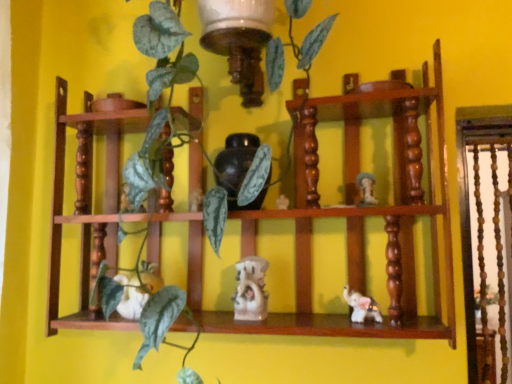
Question: From the image's perspective, is white glossy elephant at lower right, positioned as the third toy in left-to-right order, under wooden shelf at center?

Choices:
 (A) yes
 (B) no

Answer: (A)

Question: Can we say white glossy elephant at lower right, positioned as the second toy in right-to-left order, lies outside wooden shelf at center?

Choices:
 (A) yes
 (B) no

Answer: (B)

Question: Is the position of white glossy elephant at lower right, positioned as the second toy in right-to-left order, more distant than that of wooden shelf at center?

Choices:
 (A) yes
 (B) no

Answer: (A)

Question: Is white glossy elephant at lower right, positioned as the second toy in right-to-left order, positioned before wooden shelf at center?

Choices:
 (A) no
 (B) yes

Answer: (A)

Question: From a real-world perspective, is white glossy elephant at lower right, positioned as the second toy in right-to-left order, over wooden shelf at center?

Choices:
 (A) no
 (B) yes

Answer: (A)

Question: From the image's perspective, is matte black vase at center located above or below white matte rabbit at center, arranged as the first toy when viewed from the left?

Choices:
 (A) above
 (B) below

Answer: (A)

Question: Is matte black vase at center wider or thinner than white matte rabbit at center, the fourth toy from the right?

Choices:
 (A) thin
 (B) wide

Answer: (B)

Question: Which is correct: matte black vase at center is inside white matte rabbit at center, arranged as the first toy when viewed from the left, or outside of it?

Choices:
 (A) inside
 (B) outside

Answer: (B)

Question: Considering the positions of matte black vase at center and white matte rabbit at center, arranged as the first toy when viewed from the left, in the image, is matte black vase at center taller or shorter than white matte rabbit at center, arranged as the first toy when viewed from the left,?

Choices:
 (A) tall
 (B) short

Answer: (A)

Question: Considering the positions of wooden shelf at center and matte black vase at center in the image, is wooden shelf at center taller or shorter than matte black vase at center?

Choices:
 (A) tall
 (B) short

Answer: (A)

Question: In the image, is wooden shelf at center positioned in front of or behind matte black vase at center?

Choices:
 (A) front
 (B) behind

Answer: (A)

Question: Considering the positions of wooden shelf at center and matte black vase at center in the image, is wooden shelf at center bigger or smaller than matte black vase at center?

Choices:
 (A) big
 (B) small

Answer: (A)

Question: From the image's perspective, is wooden shelf at center positioned above or below matte black vase at center?

Choices:
 (A) below
 (B) above

Answer: (A)

Question: Considering the positions of matte black vase at center and white glossy elephant at lower right, positioned as the third toy in left-to-right order, in the image, is matte black vase at center bigger or smaller than white glossy elephant at lower right, positioned as the third toy in left-to-right order,?

Choices:
 (A) big
 (B) small

Answer: (A)

Question: Is point (236, 205) closer or farther from the camera than point (344, 289)?

Choices:
 (A) closer
 (B) farther

Answer: (A)